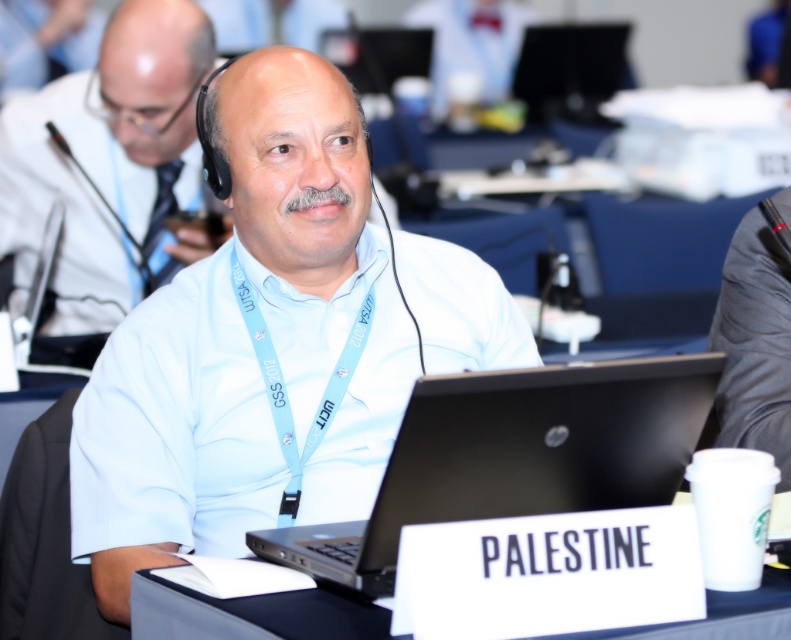
You are organizing a conference and need to place a name tag and a laptop on a table. Given the current setup, where is the light blue fabric lanyard at center relative to the black matte laptop at center?

The black matte laptop at center is positioned on the right side of the light blue fabric lanyard at center, so the light blue fabric lanyard at center is on the left side of the black matte laptop at center.

You are an event organizer who needs to arrange name tags for attendees. The gray fabric suit at right and the light blue fabric lanyard at center are both present in the scene. Which object should you place the name tag on to ensure it is visible to others?

The gray fabric suit at right is taller than the light blue fabric lanyard at center, so placing the name tag on the gray fabric suit at right would make it more visible to others.

You are organizing a conference and need to ensure that the black matte laptop at center and the light blue fabric lanyard at center can both fit on a small desk. The desk has a maximum capacity of 10 cm in width. Can both items be placed on the desk without exceeding its width?

The black matte laptop at center is larger in size than the light blue fabric lanyard at center. However, without knowing the exact dimensions of each item, it is impossible to determine if they can both fit within the 10 cm width limit. Additional measurements are required.